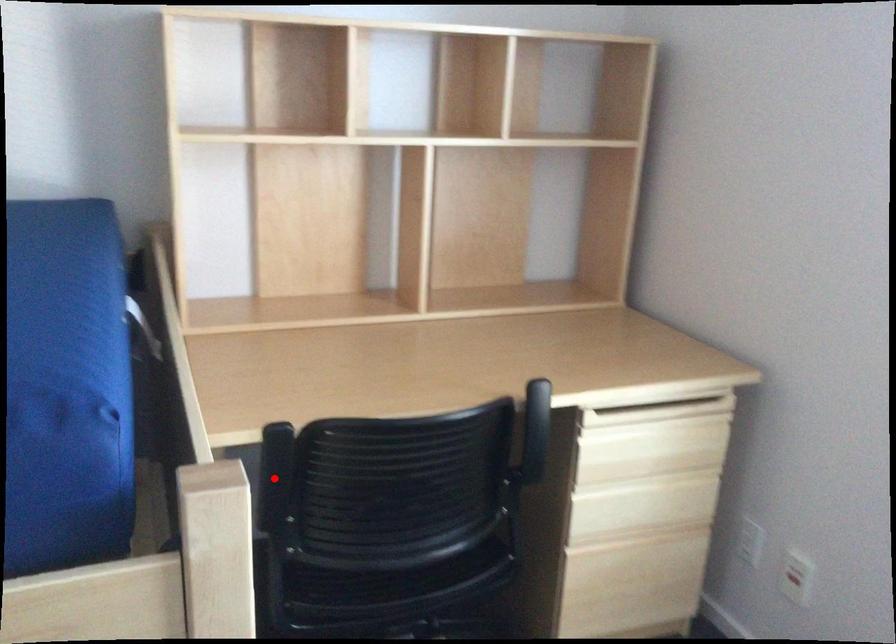
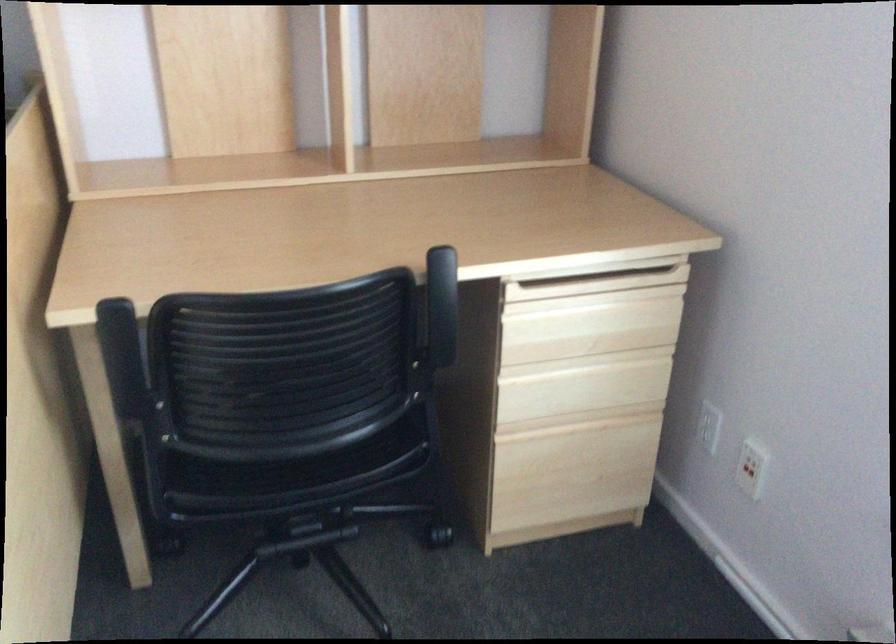
Locate, in the second image, the point that corresponds to the highlighted location in the first image.

(123, 360)